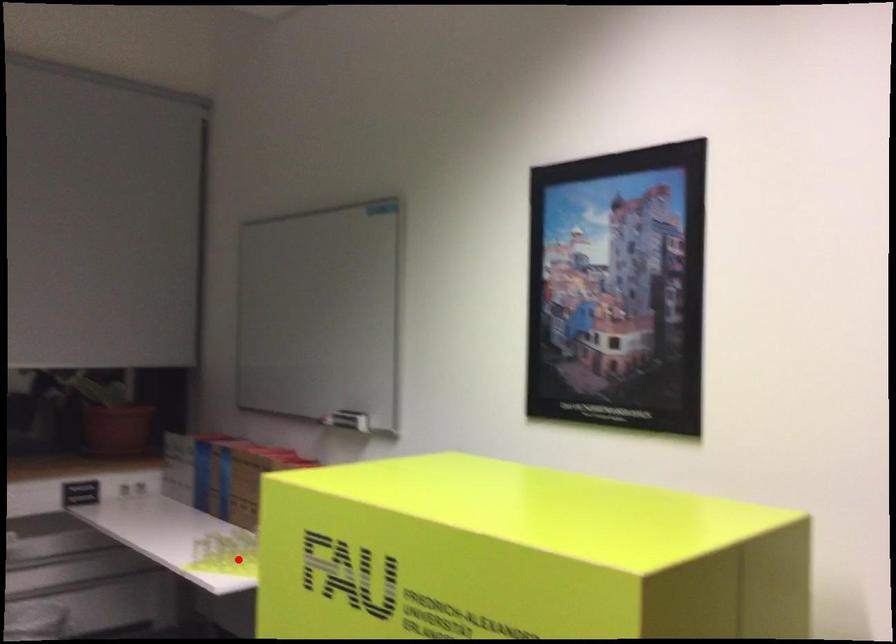
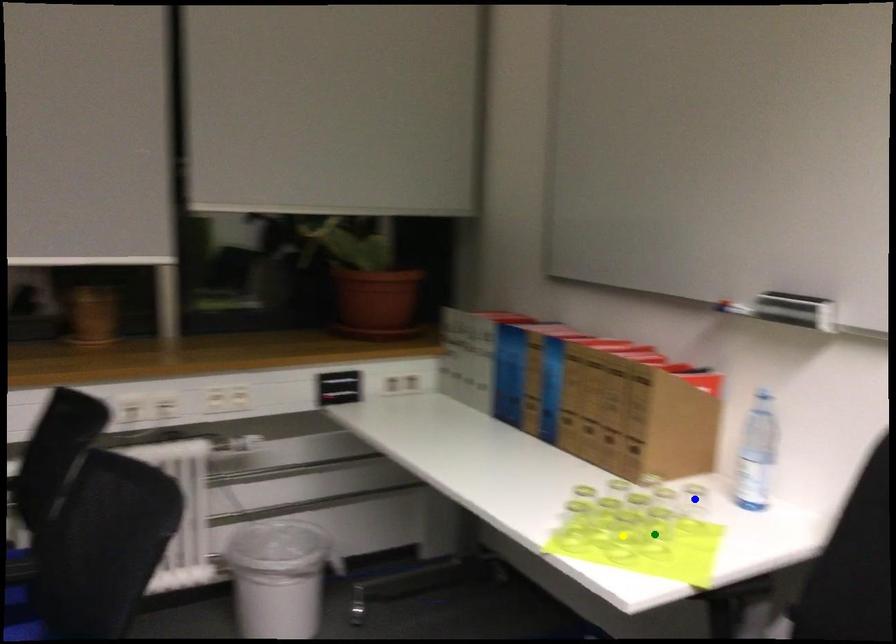
Question: I am providing you with two images of the same scene from different viewpoints. A red point is marked on the first image. You are given multiple points on the second image. Which point in image 2 is actually the same real-world point as the red point in image 1?

Choices:
 (A) green point
 (B) yellow point
 (C) blue point

Answer: (B)